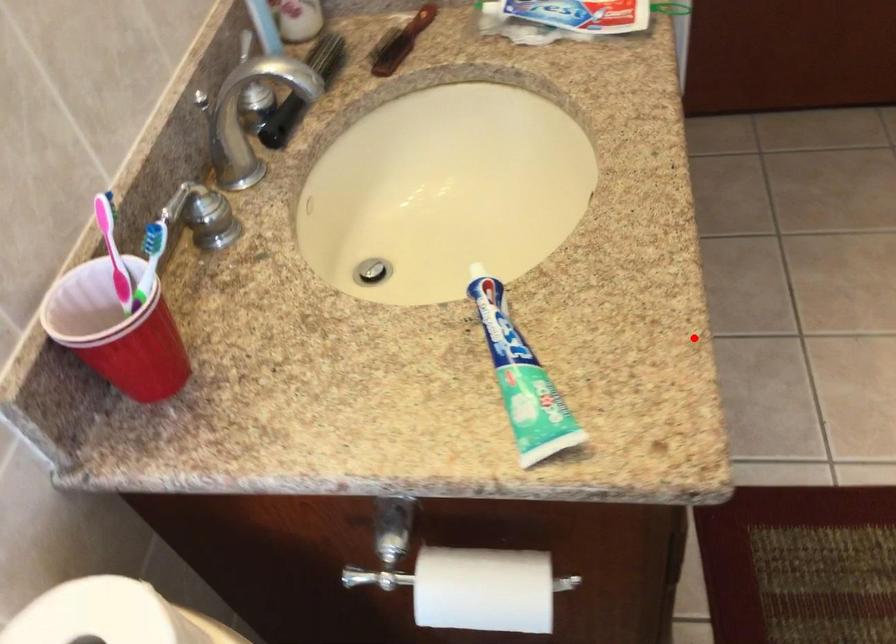
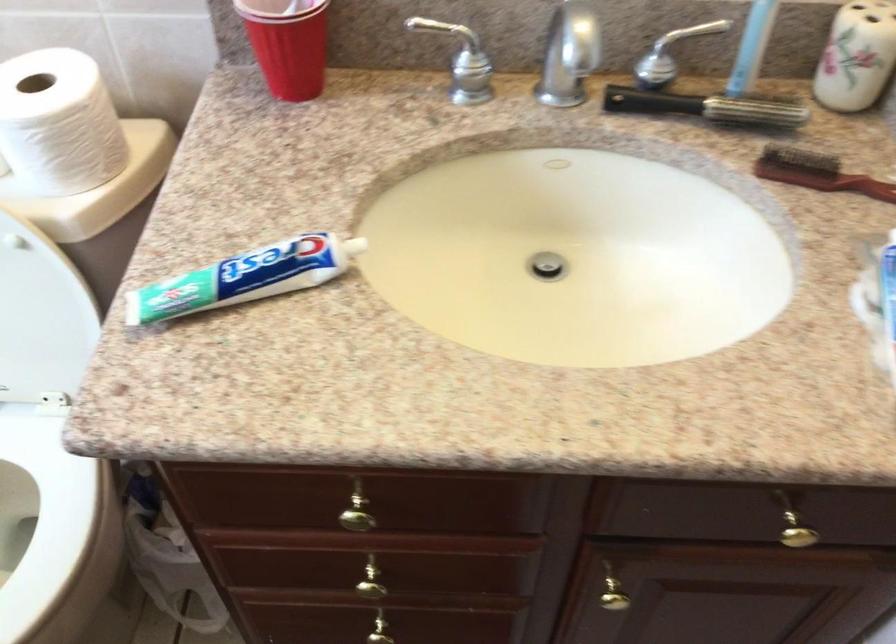
The point at the highlighted location is marked in the first image. Where is the corresponding point in the second image?

(358, 509)